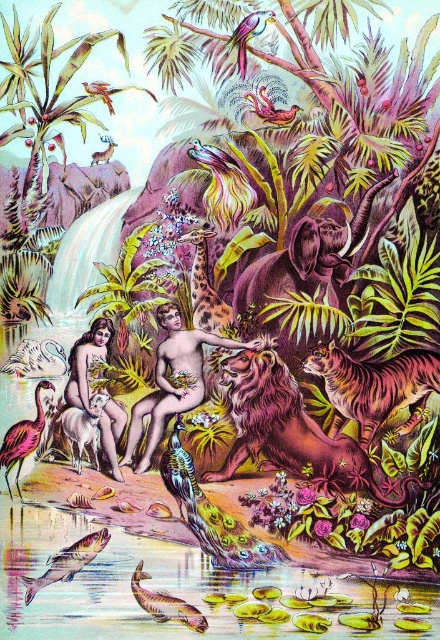
Question: Does smooth skin figure at center have a lesser width compared to pink feathered bird at lower left?

Choices:
 (A) no
 (B) yes

Answer: (A)

Question: Which is farther from the shiny metallic fish at lower center?

Choices:
 (A) matte skin nude at center
 (B) shiny brown lion at center

Answer: (B)

Question: Is orange striped tiger at center right below smooth skin figure at center?

Choices:
 (A) yes
 (B) no

Answer: (A)

Question: Is smooth skin figure at center positioned before shiny metallic fish at lower center?

Choices:
 (A) no
 (B) yes

Answer: (A)

Question: Among these objects, which one is farthest from the camera?

Choices:
 (A) shiny metallic fish at lower center
 (B) smooth skin figure at center

Answer: (B)

Question: Which point is farther to the camera?

Choices:
 (A) (36, 442)
 (B) (91, 392)

Answer: (A)